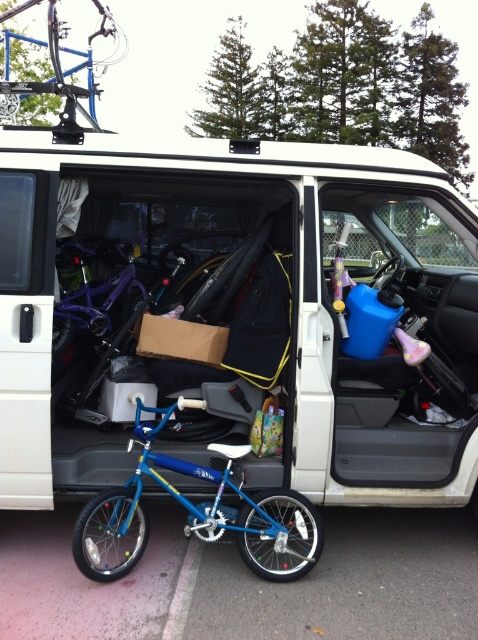
You are helping to organize the items inside the van. You need to move the shiny purple bicycle at center to the left side of the van. Is the blue matte bicycle at center currently blocking its path?

The blue matte bicycle at center is to the right of the shiny purple bicycle at center, so moving the shiny purple bicycle at center to the left would require moving the blue matte bicycle at center first to clear the path.